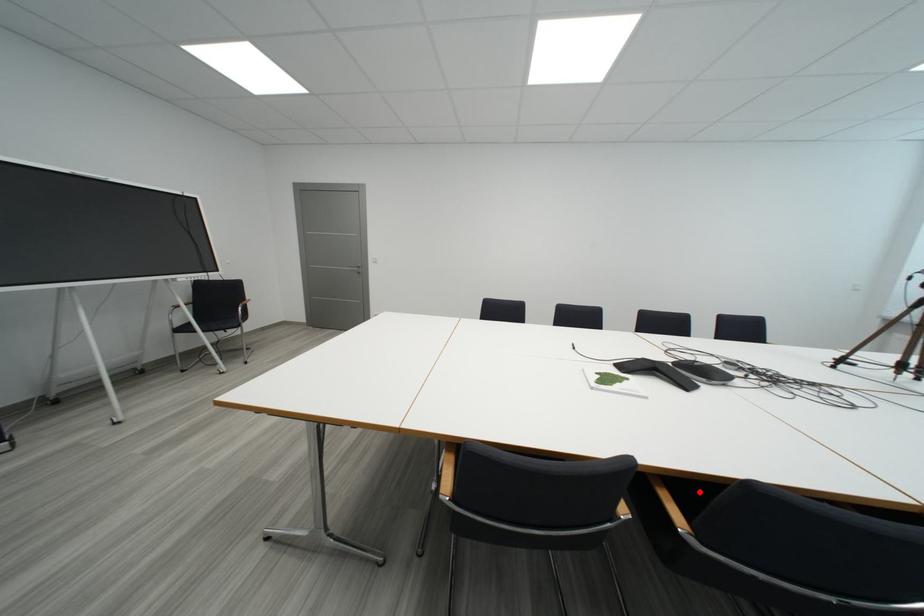
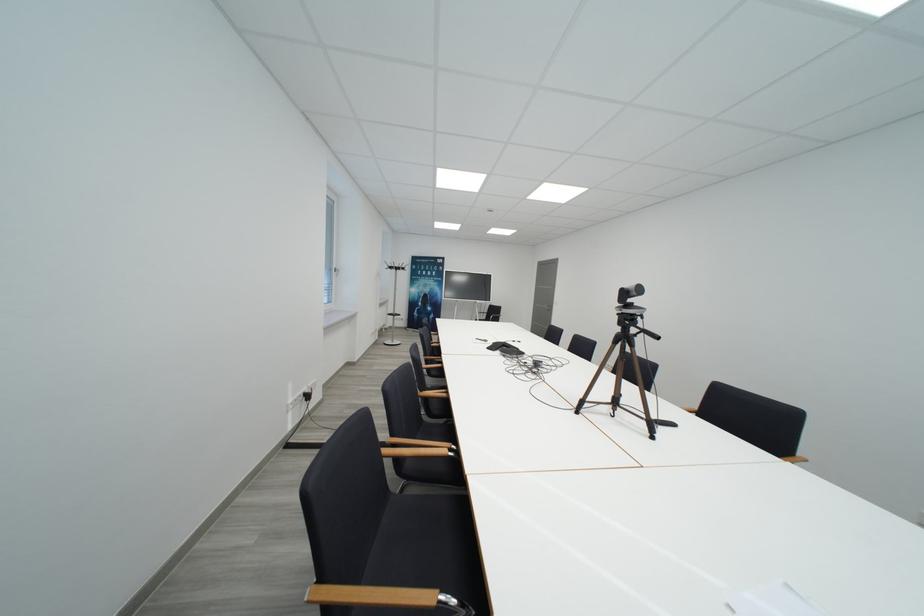
Question: I am providing you with two images of the same scene from different viewpoints. A red point is marked on the first image. Can you still see the location of the red point in image 2?

Choices:
 (A) Yes
 (B) No

Answer: (B)